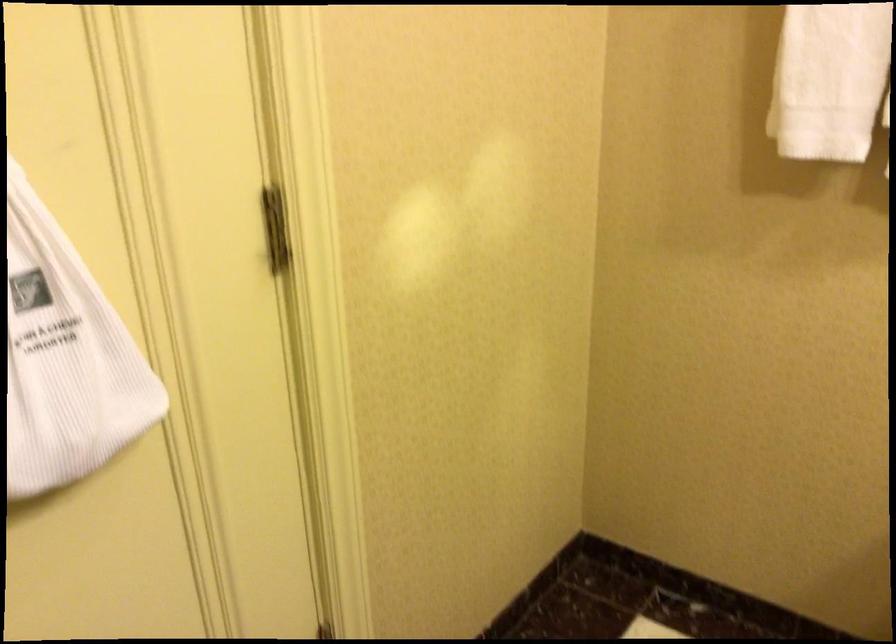
The image size is (896, 644). Find the location of `white laundry bag`. white laundry bag is located at coordinates (65, 357).